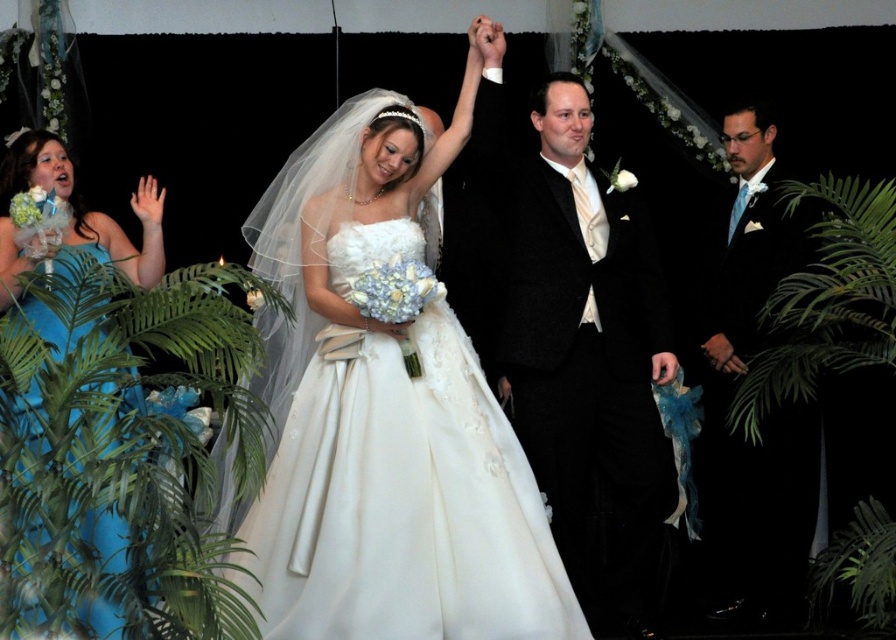
You are a photographer at a wedding. You need to position yourself so that both the shiny black suit at center and the teal satin dress at left are in frame. Considering their heights, which one might you need to adjust your camera angle for to ensure both are fully visible?

The shiny black suit at center is taller than the teal satin dress at left, so you might need to lower your camera angle slightly to ensure the taller shiny black suit at center is fully visible while keeping the teal satin dress at left in frame.

You are a photographer at a wedding. You need to capture a photo of the shiny black suit at center and the teal satin dress at left. Based on their positions, which one is lower in the image?

The shiny black suit at center is below the teal satin dress at left, so the shiny black suit at center is lower in the image.